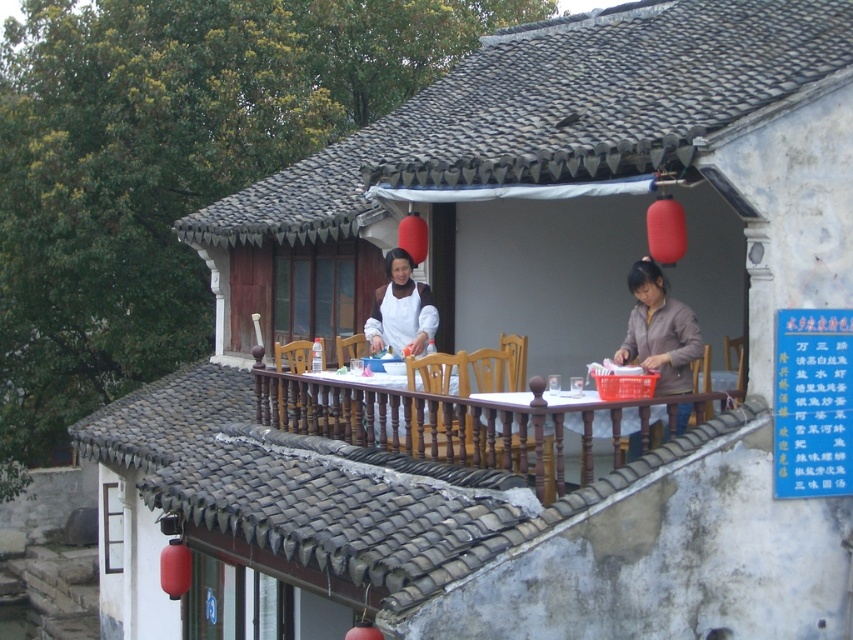
Question: Which is nearer to the brown matte jacket at upper right?

Choices:
 (A) wooden table at center
 (B) matte white apron at center

Answer: (A)

Question: Observing the image, what is the correct spatial positioning of wooden table at center in reference to matte white apron at center?

Choices:
 (A) above
 (B) below

Answer: (B)

Question: Is wooden table at center thinner than matte white apron at center?

Choices:
 (A) yes
 (B) no

Answer: (B)

Question: Can you confirm if wooden table at center is thinner than matte white apron at center?

Choices:
 (A) no
 (B) yes

Answer: (A)

Question: Which of the following is the closest to the observer?

Choices:
 (A) wooden table at center
 (B) brown matte jacket at upper right

Answer: (A)

Question: Which point is farther to the camera?

Choices:
 (A) (653, 294)
 (B) (596, 420)
 (C) (402, 337)

Answer: (C)